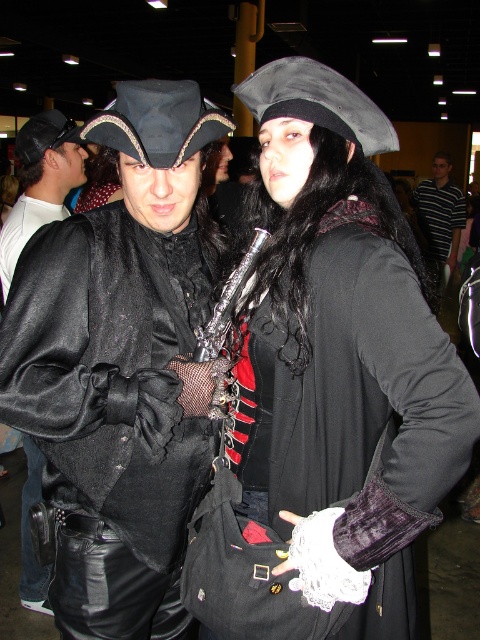
Does matte black coat at center have a greater width compared to velvet black coat at center?

In fact, matte black coat at center might be narrower than velvet black coat at center.

Is matte black coat at center taller than velvet black coat at center?

Indeed, matte black coat at center has a greater height compared to velvet black coat at center.

Does point (184, 198) come closer to viewer compared to point (84, 209)?

That is True.

You are a GUI agent. You are given a task and a screenshot of the screen. Output one action in this format:
    pyautogui.click(x=<x>, y=<y>)
    Task: Click on the matte black coat at center
    The width and height of the screenshot is (480, 640).
    Given the screenshot: What is the action you would take?
    pyautogui.click(x=121, y=365)

Is matte black coat at center to the left of matte black jacket at left from the viewer's perspective?

Incorrect, matte black coat at center is not on the left side of matte black jacket at left.

Does matte black coat at center have a smaller size compared to matte black jacket at left?

Yes, matte black coat at center is smaller than matte black jacket at left.

Where is `matte black coat at center`? Image resolution: width=480 pixels, height=640 pixels. matte black coat at center is located at coordinates click(121, 365).

Locate an element on the screen. The width and height of the screenshot is (480, 640). matte black coat at center is located at coordinates (121, 365).

Is matte black coat at center wider than velvet black glove at center?

Incorrect, matte black coat at center's width does not surpass velvet black glove at center's.

Is point (101, 120) closer to viewer compared to point (423, 458)?

No, it is behind (423, 458).

Between point (164, 387) and point (265, 628), which one is positioned in front?

Point (265, 628)

Locate an element on the screen. matte black coat at center is located at coordinates (121, 365).